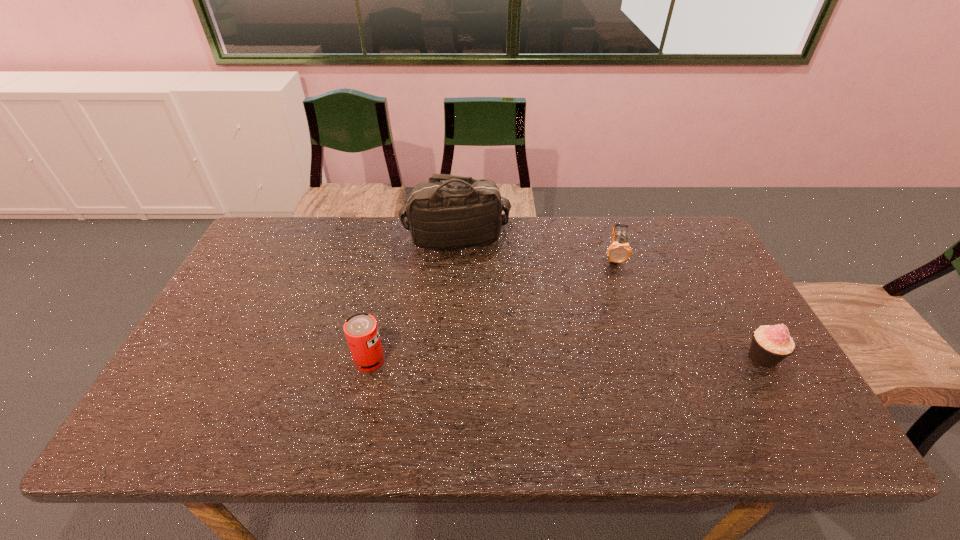
This screenshot has height=540, width=960. I want to click on can, so click(361, 331).

Where is `the rightmost object`? The height and width of the screenshot is (540, 960). the rightmost object is located at coordinates (770, 345).

Identify the location of the second object from right to left. This screenshot has height=540, width=960. tap(619, 251).

At what (x,y) coordinates should I click in order to perform the action: click on shoulder bag. Please return your answer as a coordinate pair (x, y). Looking at the image, I should click on pos(457,212).

The height and width of the screenshot is (540, 960). I want to click on free space located on the back of the second tallest object, so click(395, 249).

At what (x,y) coordinates should I click in order to perform the action: click on free space located on the back of the cupcake. Please return your answer as a coordinate pair (x, y). The image size is (960, 540). Looking at the image, I should click on (708, 261).

Where is `free space located 0.370m on the face of the third object from left to right`? This screenshot has width=960, height=540. free space located 0.370m on the face of the third object from left to right is located at coordinates (622, 370).

At what (x,y) coordinates should I click in order to perform the action: click on free location located on the face of the third object from left to right. Please return your answer as a coordinate pair (x, y). The image size is (960, 540). Looking at the image, I should click on (620, 348).

Locate an element on the screen. vacant space located 0.080m on the face of the third object from left to right is located at coordinates (616, 288).

Image resolution: width=960 pixels, height=540 pixels. I want to click on vacant space located at the front padded panel of the tallest object, so click(x=482, y=269).